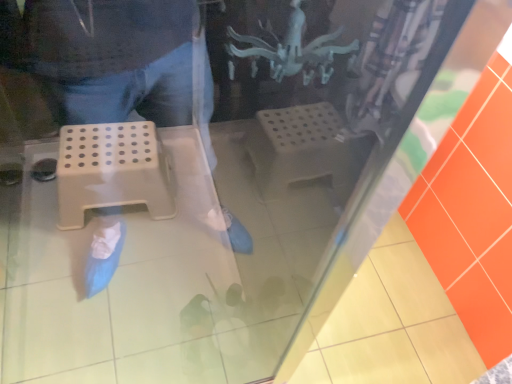
In order to face white plastic step stool at left, should I rotate leftwards or rightwards?

Rotate your view left by about 18.355°.

Identify the location of white plastic step stool at left. (112, 171).

This screenshot has height=384, width=512. What do you see at coordinates (112, 171) in the screenshot?
I see `white plastic step stool at left` at bounding box center [112, 171].

Where is `white plastic step stool at left`? white plastic step stool at left is located at coordinates (x=112, y=171).